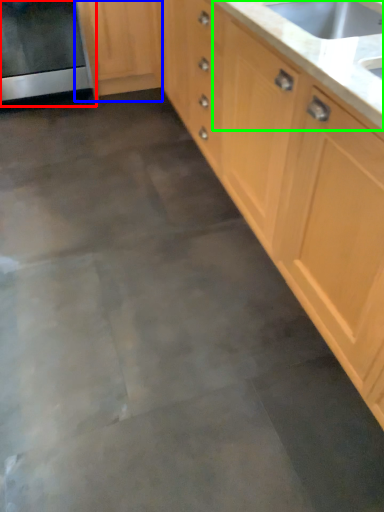
Question: Which object is positioned farthest from oven (highlighted by a red box)? Select from cabinetry (highlighted by a blue box) and countertop (highlighted by a green box).

Choices:
 (A) cabinetry
 (B) countertop

Answer: (B)